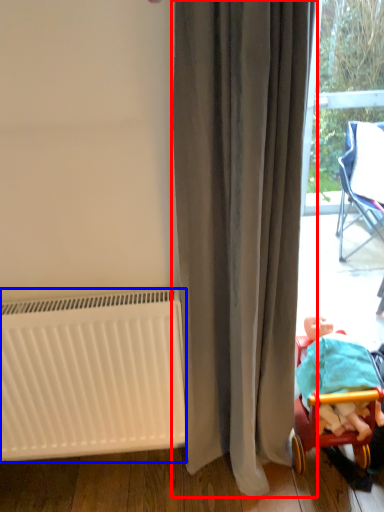
Question: Which of the following is the farthest to the observer, curtain (highlighted by a red box) or radiator (highlighted by a blue box)?

Choices:
 (A) curtain
 (B) radiator

Answer: (B)